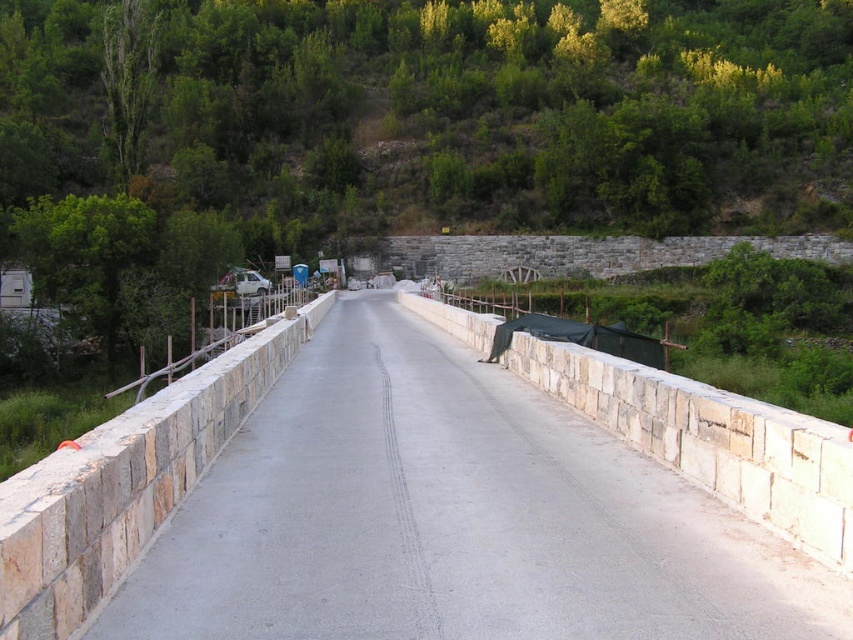
Question: Among these points, which one is nearest to the camera?

Choices:
 (A) (90, 516)
 (B) (735, 561)
 (C) (393, 33)

Answer: (A)

Question: Is green leafy tree at center in front of smooth concrete highway at center?

Choices:
 (A) no
 (B) yes

Answer: (A)

Question: Is smooth concrete highway at center positioned behind white stone wall at center?

Choices:
 (A) no
 (B) yes

Answer: (A)

Question: Does green leafy tree at center have a smaller size compared to natural stone wall at left?

Choices:
 (A) yes
 (B) no

Answer: (B)

Question: Considering the real-world distances, which object is closest to the white stone wall at center?

Choices:
 (A) natural stone wall at left
 (B) green leafy tree at center
 (C) smooth concrete highway at center

Answer: (C)

Question: Which of the following is the farthest from the observer?

Choices:
 (A) (103, 156)
 (B) (347, 524)
 (C) (573, 360)
 (D) (102, 568)

Answer: (A)